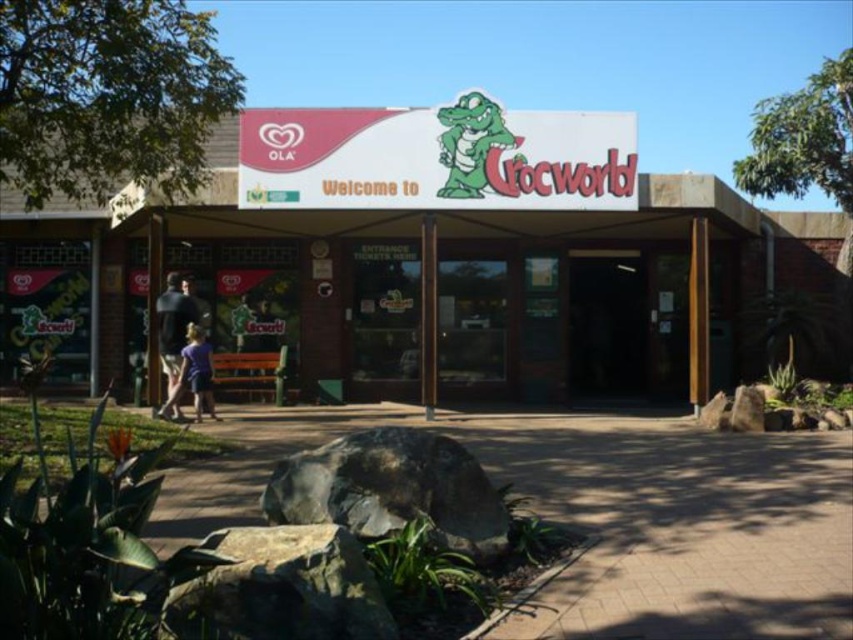
Between white plastic sign at center and black glass door at center, which one has more height?

white plastic sign at center is taller.

Does white plastic sign at center appear under black glass door at center?

Incorrect, white plastic sign at center is not positioned below black glass door at center.

Between point (688, 356) and point (633, 280), which one is positioned behind?

The point (633, 280) is more distant.

Where is `white plastic sign at center`? white plastic sign at center is located at coordinates (444, 256).

Who is more distant from viewer, (88,260) or (202,392)?

The point (88,260) is behind.

Does white plastic sign at center have a lesser height compared to purple fabric dress at center?

In fact, white plastic sign at center may be taller than purple fabric dress at center.

Which is in front, point (523, 321) or point (196, 349)?

Point (196, 349) is more forward.

At what (x,y) coordinates should I click in order to perform the action: click on white plastic sign at center. Please return your answer as a coordinate pair (x, y). This screenshot has height=640, width=853. Looking at the image, I should click on click(444, 256).

Does black glass door at center appear under purple fabric dress at center?

Incorrect, black glass door at center is not positioned below purple fabric dress at center.

Does point (589, 266) come in front of point (190, 369)?

No, it is behind (190, 369).

What do you see at coordinates (607, 324) in the screenshot? This screenshot has height=640, width=853. I see `black glass door at center` at bounding box center [607, 324].

Where is `black glass door at center`? The width and height of the screenshot is (853, 640). black glass door at center is located at coordinates (607, 324).